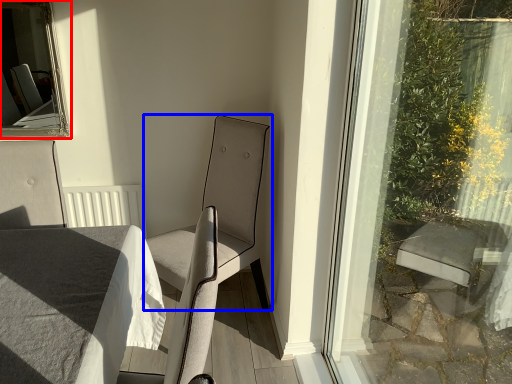
Question: Which of the following is the closest to the observer, bay window (highlighted by a red box) or chair (highlighted by a blue box)?

Choices:
 (A) bay window
 (B) chair

Answer: (B)